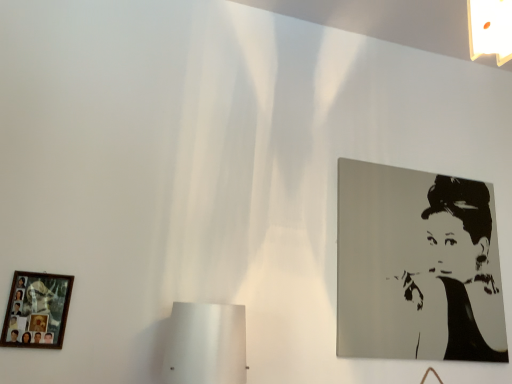
Question: Is black glossy portrait at upper right, acting as the first picture frame starting from the back, far from wooden photo frame at lower left, the 1th picture frame when ordered from front to back?

Choices:
 (A) yes
 (B) no

Answer: (A)

Question: Does black glossy portrait at upper right, acting as the first picture frame starting from the back, have a greater height compared to wooden photo frame at lower left, marked as the second picture frame in a right-to-left arrangement?

Choices:
 (A) no
 (B) yes

Answer: (B)

Question: From a real-world perspective, is black glossy portrait at upper right, the 2th picture frame from the left, located higher than wooden photo frame at lower left, the 2th picture frame from the back?

Choices:
 (A) yes
 (B) no

Answer: (A)

Question: Considering the relative positions of black glossy portrait at upper right, the 2th picture frame from the left, and wooden photo frame at lower left, the 2th picture frame from the back, in the image provided, is black glossy portrait at upper right, the 2th picture frame from the left, to the right of wooden photo frame at lower left, the 2th picture frame from the back, from the viewer's perspective?

Choices:
 (A) no
 (B) yes

Answer: (B)

Question: Is black glossy portrait at upper right, the 2th picture frame positioned from the front, next to wooden photo frame at lower left, the 2th picture frame from the back?

Choices:
 (A) no
 (B) yes

Answer: (A)

Question: Would you say wooden photo frame at lower left, the 2th picture frame from the back, is part of black glossy portrait at upper right, the 2th picture frame positioned from the front,'s contents?

Choices:
 (A) yes
 (B) no

Answer: (B)

Question: Considering the relative sizes of wooden photo frame at lower left, the 1th picture frame when ordered from front to back, and black glossy portrait at upper right, the 2th picture frame from the left, in the image provided, is wooden photo frame at lower left, the 1th picture frame when ordered from front to back, thinner than black glossy portrait at upper right, the 2th picture frame from the left,?

Choices:
 (A) yes
 (B) no

Answer: (A)

Question: Is wooden photo frame at lower left, marked as the second picture frame in a right-to-left arrangement, positioned in front of black glossy portrait at upper right, which is counted as the first picture frame, starting from the right?

Choices:
 (A) no
 (B) yes

Answer: (B)

Question: From a real-world perspective, is wooden photo frame at lower left, the first picture frame when ordered from left to right, under black glossy portrait at upper right, acting as the first picture frame starting from the back?

Choices:
 (A) no
 (B) yes

Answer: (B)

Question: Is wooden photo frame at lower left, the 1th picture frame when ordered from front to back, next to black glossy portrait at upper right, which is counted as the first picture frame, starting from the right, and touching it?

Choices:
 (A) no
 (B) yes

Answer: (A)

Question: Is wooden photo frame at lower left, the 1th picture frame when ordered from front to back, looking in the opposite direction of black glossy portrait at upper right, which is counted as the first picture frame, starting from the right?

Choices:
 (A) yes
 (B) no

Answer: (B)

Question: Is wooden photo frame at lower left, the 1th picture frame when ordered from front to back, far from black glossy portrait at upper right, which is counted as the first picture frame, starting from the right?

Choices:
 (A) yes
 (B) no

Answer: (A)

Question: Considering the positions of wooden photo frame at lower left, marked as the second picture frame in a right-to-left arrangement, and black glossy portrait at upper right, the 2th picture frame from the left, in the image, is wooden photo frame at lower left, marked as the second picture frame in a right-to-left arrangement, taller or shorter than black glossy portrait at upper right, the 2th picture frame from the left,?

Choices:
 (A) tall
 (B) short

Answer: (B)